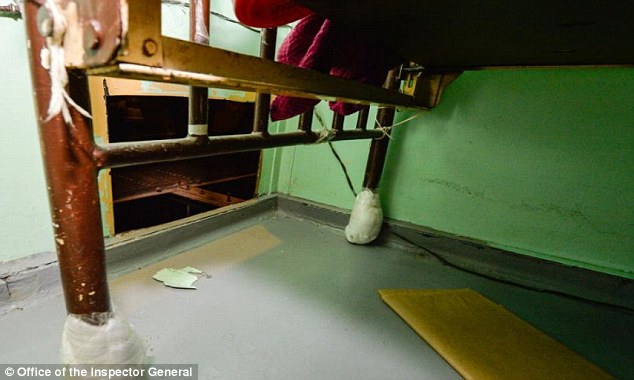
At what (x,y) coordinates should I click in order to perform the action: click on grey wall. Please return your answer as a coordinate pair (x, y). Looking at the image, I should click on (22, 200).